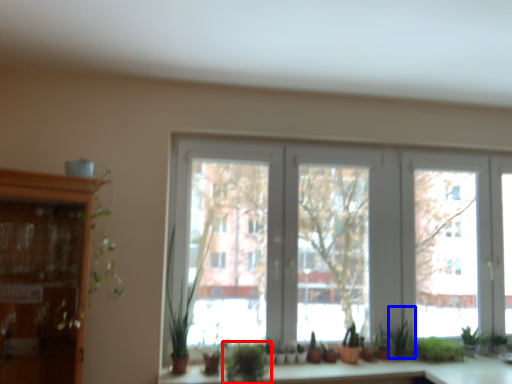
Question: Which of the following is the farthest to the observer, houseplant (highlighted by a red box) or plant (highlighted by a blue box)?

Choices:
 (A) houseplant
 (B) plant

Answer: (B)